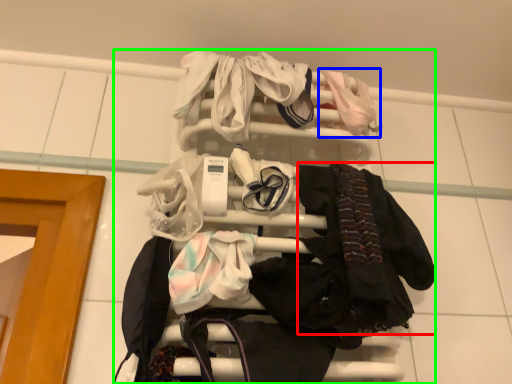
Question: Considering the real-world distances, which object is closest to clothing (highlighted by a red box)? baby clothe (highlighted by a blue box) or bunk bed (highlighted by a green box).

Choices:
 (A) baby clothe
 (B) bunk bed

Answer: (B)